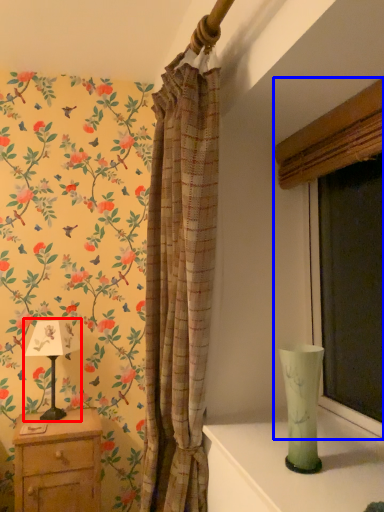
Question: Which object is further to the camera taking this photo, table lamp (highlighted by a red box) or window (highlighted by a blue box)?

Choices:
 (A) table lamp
 (B) window

Answer: (A)